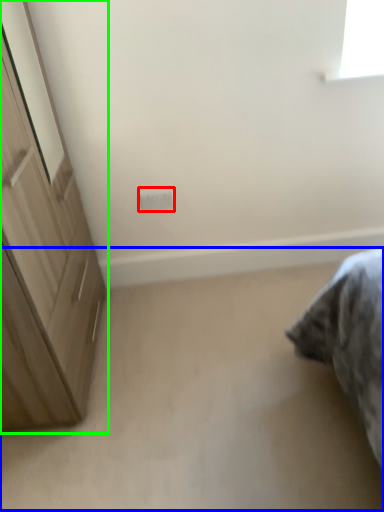
Question: Estimate the real-world distances between objects in this image. Which object is farther from electric outlet (highlighted by a red box), plain (highlighted by a blue box) or cupboard (highlighted by a green box)?

Choices:
 (A) plain
 (B) cupboard

Answer: (A)